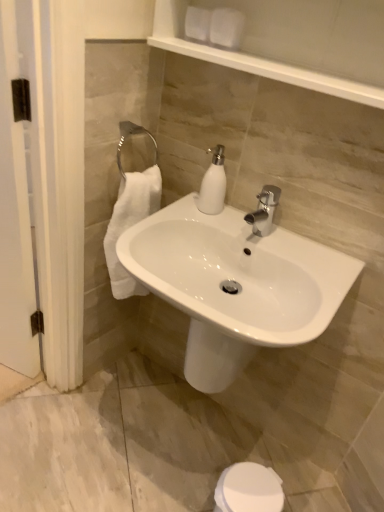
Identify the location of blank area to the left of white glossy soap dispenser at center. (170, 213).